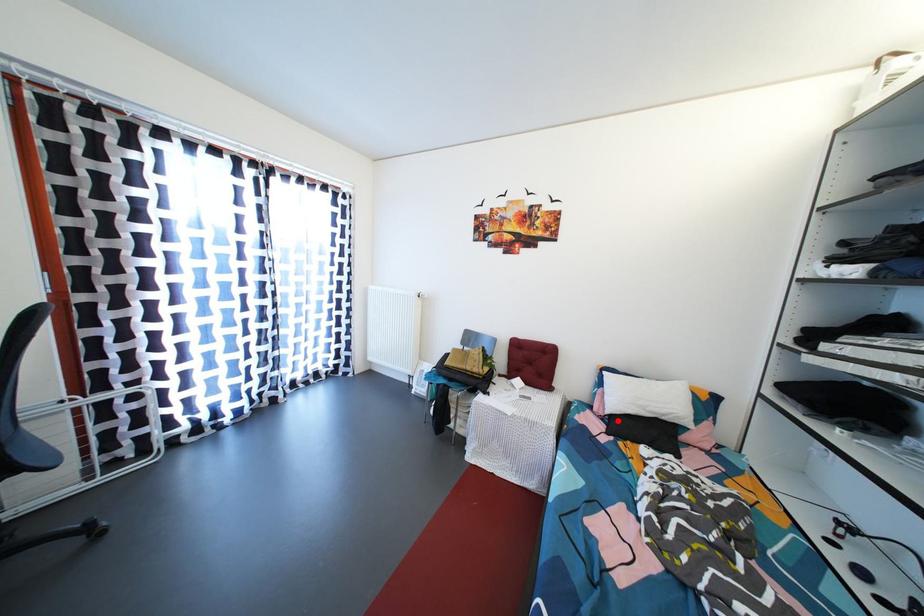
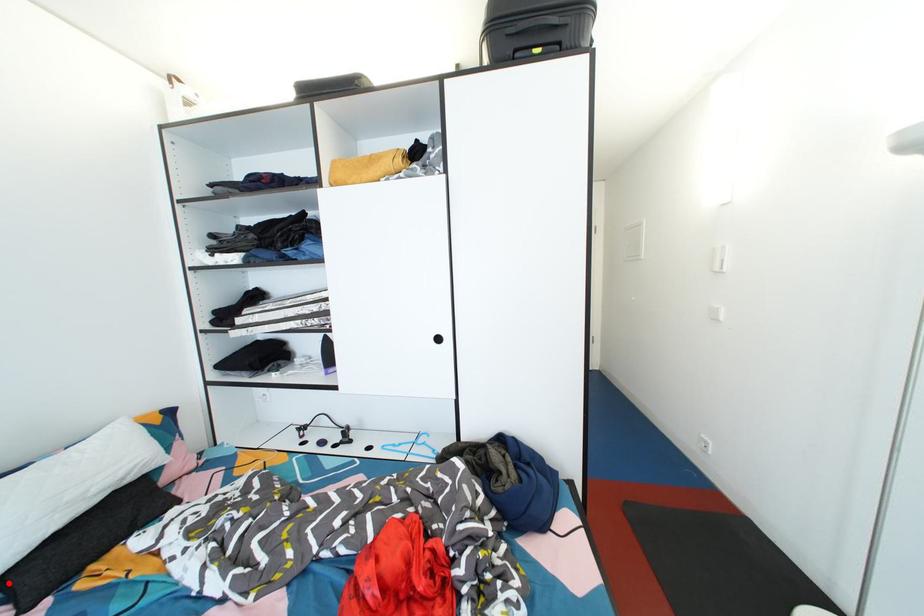
I am providing you with two images of the same scene from different viewpoints. A red point is marked on the first image and another point is marked on the second image. Does the point marked in image1 correspond to the same location as the one in image2?

Yes